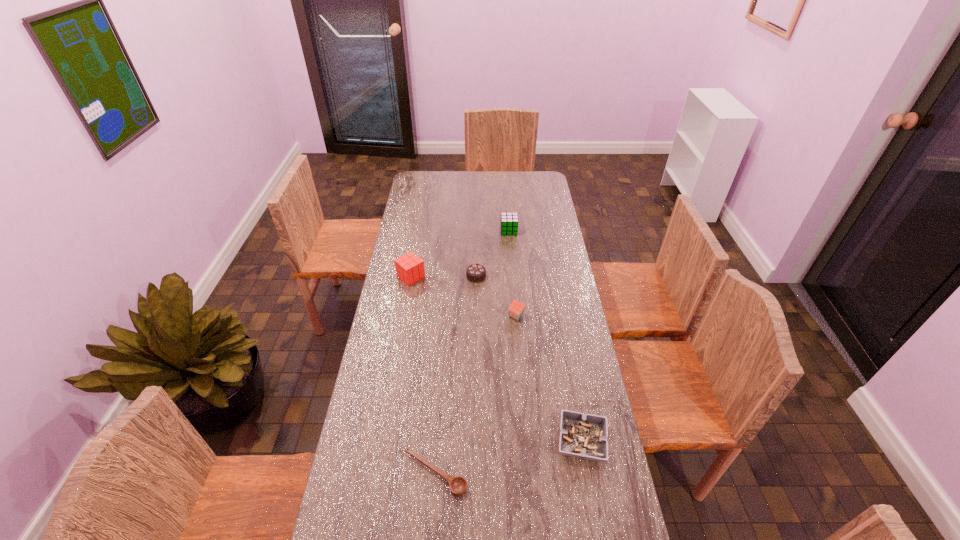
Locate an element on the screen. the leftmost cube is located at coordinates (x=409, y=268).

You are a GUI agent. You are given a task and a screenshot of the screen. Output one action in this format:
    pyautogui.click(x=<x>, y=<y>)
    Task: Click on the second farthest cube
    The image size is (960, 540).
    Given the screenshot: What is the action you would take?
    pyautogui.click(x=409, y=268)

This screenshot has width=960, height=540. What are the coordinates of `the farthest object` in the screenshot? It's located at (509, 221).

At what (x,y) coordinates should I click in order to perform the action: click on the shortest cube. Please return your answer as a coordinate pair (x, y). This screenshot has width=960, height=540. Looking at the image, I should click on (516, 309).

Locate an element on the screen. the third nearest object is located at coordinates (516, 309).

What are the coordinates of `chocolate cake` in the screenshot? It's located at (475, 273).

Where is `the fifth tallest object`? the fifth tallest object is located at coordinates (584, 436).

You are a GUI agent. You are given a task and a screenshot of the screen. Output one action in this format:
    pyautogui.click(x=<x>, y=<y>)
    Task: Click on the ashtray
    The height and width of the screenshot is (540, 960).
    Given the screenshot: What is the action you would take?
    pyautogui.click(x=584, y=436)

Where is `wooden spoon`? Image resolution: width=960 pixels, height=540 pixels. wooden spoon is located at coordinates (458, 485).

Where is `vacant region located on the right of the leftmost object`? This screenshot has width=960, height=540. vacant region located on the right of the leftmost object is located at coordinates (462, 276).